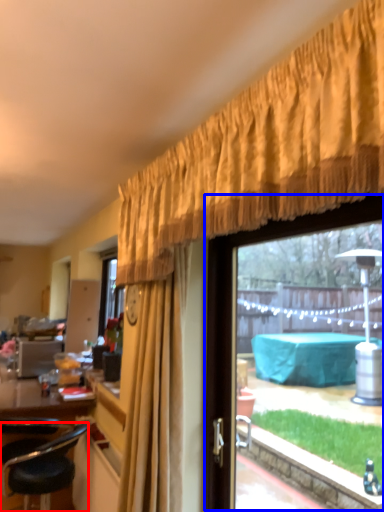
Question: Which object appears farthest to the camera in this image, chair (highlighted by a red box) or window (highlighted by a blue box)?

Choices:
 (A) chair
 (B) window

Answer: (A)